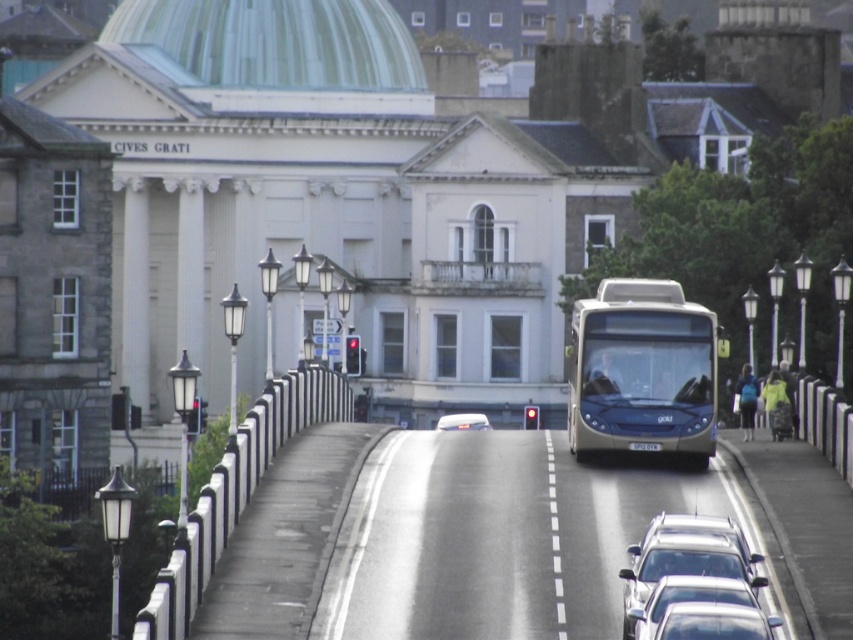
You are a pedestrian standing on the sidewalk of the bridge. You see a silver metallic car at lower center and a shiny silver car at center. Which car is narrower?

The silver metallic car at lower center is thinner than the shiny silver car at center, so it is narrower.

You are a pedestrian standing on the sidewalk of the bridge. You see a silver metallic car at lower center and a shiny silver car at center. Which car is closer to the left side of the bridge?

The silver metallic car at lower center is to the left of the shiny silver car at center, so it is closer to the left side of the bridge.

You are a pedestrian standing on the sidewalk of the bridge. You notice a silver metallic car at lower center and a shiny silver car at center. Which car is taller?

The silver metallic car at lower center is taller than the shiny silver car at center.